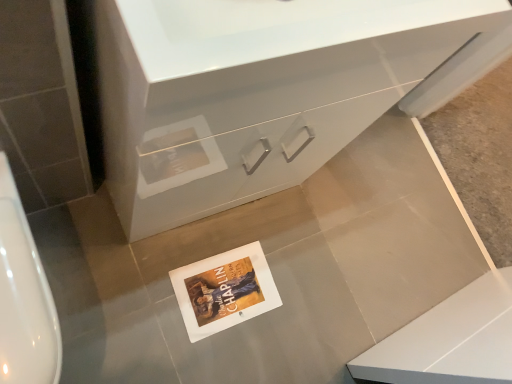
Identify the location of white glossy cabinet at center. The image size is (512, 384). (264, 90).

Measure the distance between white glossy cabinet at center and camera.

The distance of white glossy cabinet at center from camera is 18.06 inches.

This screenshot has height=384, width=512. What do you see at coordinates (224, 290) in the screenshot?
I see `white paper postcard at center` at bounding box center [224, 290].

Find the location of a particular element. The width and height of the screenshot is (512, 384). white glossy cabinet at center is located at coordinates (264, 90).

Could you tell me if white paper postcard at center is turned towards white glossy urinal at left?

No, white paper postcard at center is not aimed at white glossy urinal at left.

Is there a large distance between white paper postcard at center and white glossy urinal at left?

Actually, white paper postcard at center and white glossy urinal at left are a little close together.

Considering the sizes of objects white paper postcard at center and white glossy urinal at left in the image provided, who is thinner, white paper postcard at center or white glossy urinal at left?

With smaller width is white paper postcard at center.

Which is in front, point (204, 305) or point (35, 378)?

The point (35, 378) is more forward.

From the image's perspective, does white glossy cabinet at center appear lower than white paper postcard at center?

Actually, white glossy cabinet at center appears above white paper postcard at center in the image.

Between white glossy cabinet at center and white paper postcard at center, which one has smaller size?

white paper postcard at center.

Can you confirm if white glossy cabinet at center is shorter than white paper postcard at center?

No, white glossy cabinet at center is not shorter than white paper postcard at center.

How far apart are white glossy cabinet at center and white paper postcard at center?

white glossy cabinet at center is 17.36 inches from white paper postcard at center.

Is white glossy urinal at left to the left or to the right of white paper postcard at center in the image?

Clearly, white glossy urinal at left is on the left of white paper postcard at center in the image.

From the image's perspective, is white glossy urinal at left located above or below white paper postcard at center?

Based on their image positions, white glossy urinal at left is located above white paper postcard at center.

Is white glossy urinal at left further to camera compared to white paper postcard at center?

No, it is not.

From a real-world perspective, is white paper postcard at center beneath white glossy cabinet at center?

Correct, in the physical world, white paper postcard at center is lower than white glossy cabinet at center.

Is white paper postcard at center oriented towards white glossy cabinet at center?

No, white paper postcard at center is not facing towards white glossy cabinet at center.

Is white paper postcard at center positioned before white glossy cabinet at center?

No, white paper postcard at center is further to the viewer.

Who is smaller, white paper postcard at center or white glossy cabinet at center?

Smaller between the two is white paper postcard at center.

What's the angular difference between white glossy cabinet at center and white glossy urinal at left's facing directions?

The angle between the facing direction of white glossy cabinet at center and the facing direction of white glossy urinal at left is 0.812 degrees.

From the image's perspective, between white glossy cabinet at center and white glossy urinal at left, who is located below?

From the image's view, white glossy urinal at left is below.

You are a GUI agent. You are given a task and a screenshot of the screen. Output one action in this format:
    pyautogui.click(x=<x>, y=<y>)
    Task: Click on the bathroom cabinet on the right of white glossy urinal at left
    The height and width of the screenshot is (384, 512).
    Given the screenshot: What is the action you would take?
    pyautogui.click(x=264, y=90)

Considering the relative positions of white glossy urinal at left and white glossy cabinet at center in the image provided, is white glossy urinal at left to the left of white glossy cabinet at center from the viewer's perspective?

Yes, white glossy urinal at left is to the left of white glossy cabinet at center.

Could you tell me if white glossy urinal at left is turned towards white glossy cabinet at center?

No, white glossy urinal at left is not aimed at white glossy cabinet at center.

Is white glossy urinal at left placed right next to white glossy cabinet at center?

No, white glossy urinal at left is not in contact with white glossy cabinet at center.

Identify the location of postcard that is under the white glossy urinal at left (from a real-world perspective). This screenshot has height=384, width=512. (224, 290).

The image size is (512, 384). Find the location of `bathroom cabinet on the right of white paper postcard at center`. bathroom cabinet on the right of white paper postcard at center is located at coordinates (264, 90).

Considering their positions, is white glossy urinal at left positioned closer to white paper postcard at center than white glossy cabinet at center?

white glossy cabinet at center lies closer to white paper postcard at center than the other object.

Based on their spatial positions, is white glossy cabinet at center or white glossy urinal at left closer to white paper postcard at center?

Answer: Based on the image, white glossy cabinet at center appears to be nearer to white paper postcard at center.

Based on their spatial positions, is white paper postcard at center or white glossy cabinet at center closer to white glossy urinal at left?

The object closer to white glossy urinal at left is white glossy cabinet at center.

Looking at the image, which one is located further to white glossy cabinet at center, white paper postcard at center or white glossy urinal at left?

The object further to white glossy cabinet at center is white paper postcard at center.

When comparing their distances from white glossy cabinet at center, does white glossy urinal at left or white paper postcard at center seem further?

white paper postcard at center lies further to white glossy cabinet at center than the other object.

Based on their spatial positions, is white glossy cabinet at center or white paper postcard at center further from white glossy urinal at left?

white paper postcard at center lies further to white glossy urinal at left than the other object.

This screenshot has width=512, height=384. Identify the location of urinal positioned between white glossy cabinet at center and white paper postcard at center from near to far. (24, 297).